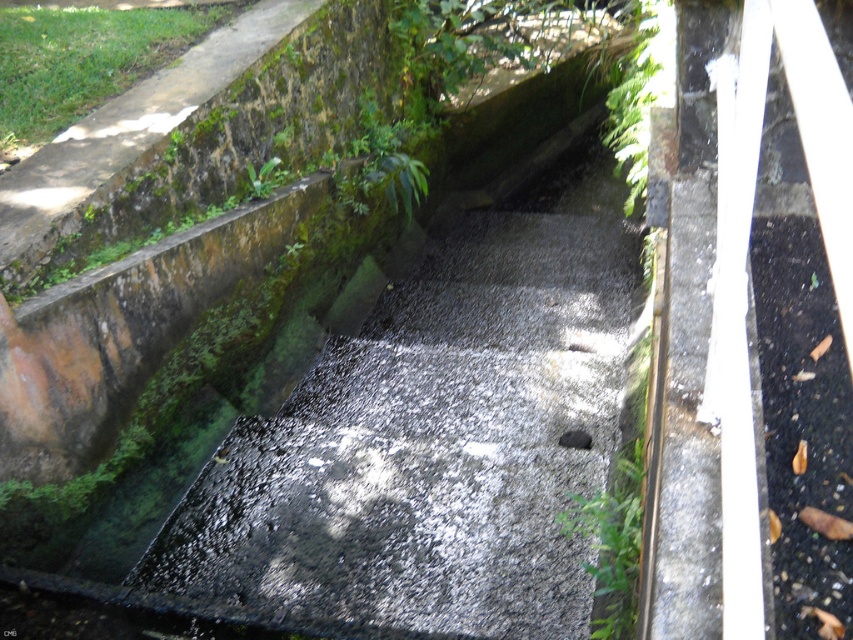
You are a maintenance worker inspecting the drainage system. You notice two concrete sections in the channel, the gray concrete at center and the black concrete drain at center. Which section do you need to check for potential structural issues first based on their sizes?

The gray concrete at center has a larger size compared to the black concrete drain at center, so it might require more attention due to its size potentially affecting the drainage flow or stability.

From the picture: You are a small robot with a width of 0.1 meters. You are positioned at point A, which is point [494,496], and you need to move to point B, which is point [570,442]. Considering the narrow channel and the position of these points, can you safely navigate from point A to point B without getting stuck?

Point [494,496] is in front of point [570,442], so the robot can navigate from point A to point B safely as the path is clear and the channel width is sufficient for its 0.1 meters width.

You are a maintenance worker needing to assess the height difference between the gray concrete at center and the black concrete drain at center in the drainage channel. Based on the scene, which one is taller?

The gray concrete at center is much taller than the black concrete drain at center.